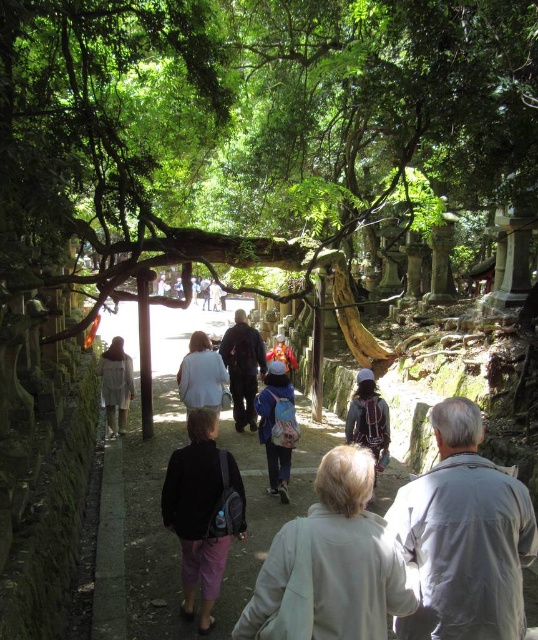
You are a photographer standing on the pathway and want to capture both the matte black jacket at center and the pastel blue backpack at center in the same frame. Which object should you position closer to the left side of your camera viewfinder to include both?

To include both the matte black jacket at center and the pastel blue backpack at center in the same frame, position the matte black jacket at center closer to the left side of your camera viewfinder since it is already to the left of the pastel blue backpack at center.

You are standing on the pathway and want to take a photo that includes both point [244,604] and point [271,419]. Which point should you focus on first to ensure both are in focus?

You should focus on point [271,419] first because it is farther from the camera, ensuring the depth of field includes both points.